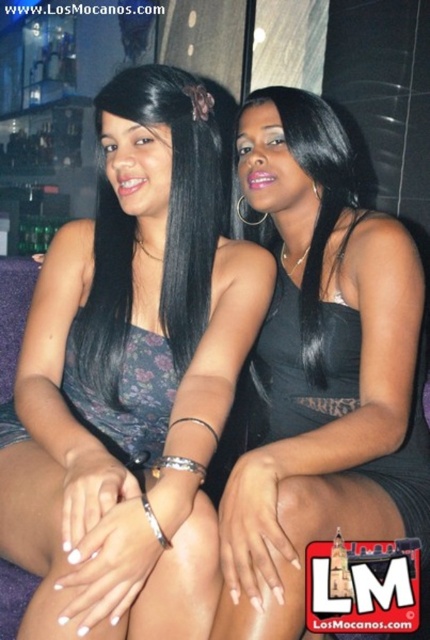
Does matte floral dress at center have a larger size compared to black satin dress at center?

Incorrect, matte floral dress at center is not larger than black satin dress at center.

Who is positioned more to the left, matte floral dress at center or black satin dress at center?

matte floral dress at center is more to the left.

Locate an element on the screen. The width and height of the screenshot is (430, 640). matte floral dress at center is located at coordinates (131, 376).

Does matte floral dress at center have a smaller size compared to black silky hair at center?

No.

Who is shorter, matte floral dress at center or black silky hair at center?

With less height is black silky hair at center.

Measure the distance between point (x=202, y=216) and camera.

Point (x=202, y=216) is 1.14 meters away from camera.

This screenshot has width=430, height=640. I want to click on matte floral dress at center, so click(x=131, y=376).

Does black silky hair at left have a larger size compared to black silky hair at center?

Yes.

Is point (203, 102) farther from camera compared to point (322, 182)?

That is False.

At what (x,y) coordinates should I click in order to perform the action: click on black silky hair at left. Please return your answer as a coordinate pair (x, y). The width and height of the screenshot is (430, 640). Looking at the image, I should click on (180, 189).